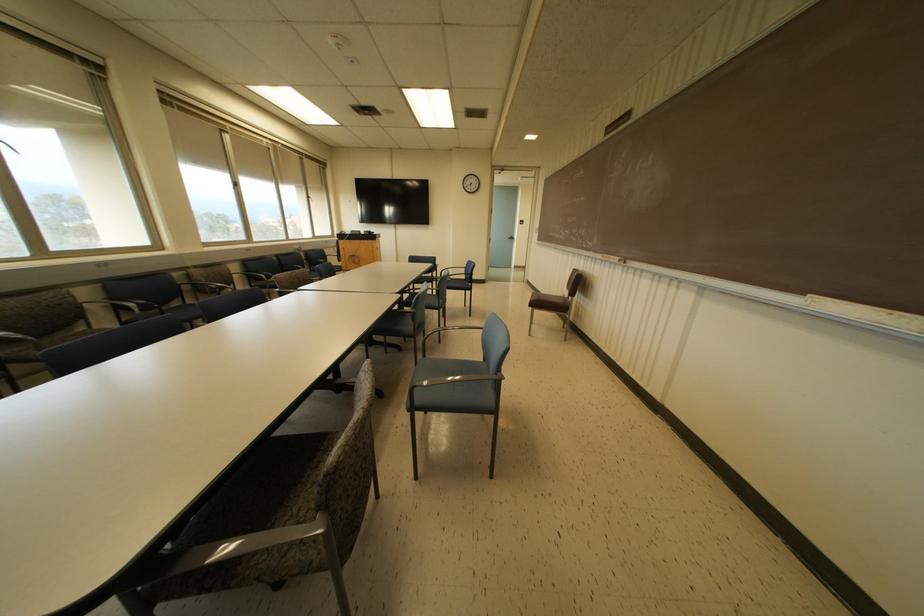
The image size is (924, 616). What do you see at coordinates (612, 257) in the screenshot?
I see `a chalkboard eraser` at bounding box center [612, 257].